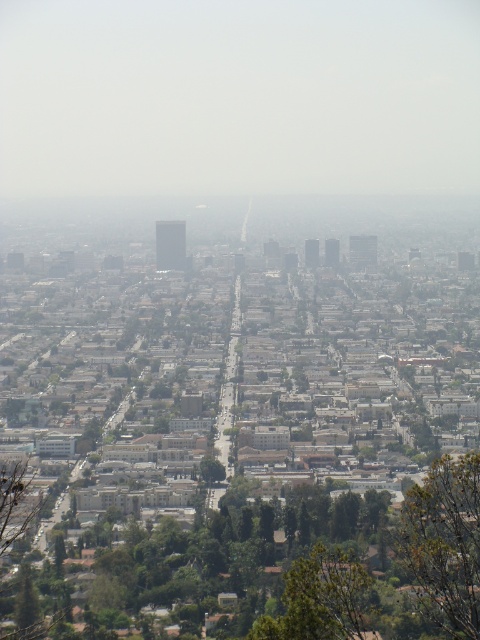
Does green leafy tree at lower right appear on the left side of green leafy tree at lower center?

In fact, green leafy tree at lower right is to the right of green leafy tree at lower center.

Measure the distance between point [427,493] and camera.

Point [427,493] and camera are 666.08 meters apart.

Between point (430, 618) and point (349, 588), which one is positioned in front?

Point (349, 588) is in front.

The image size is (480, 640). Identify the location of green leafy tree at lower right. (444, 544).